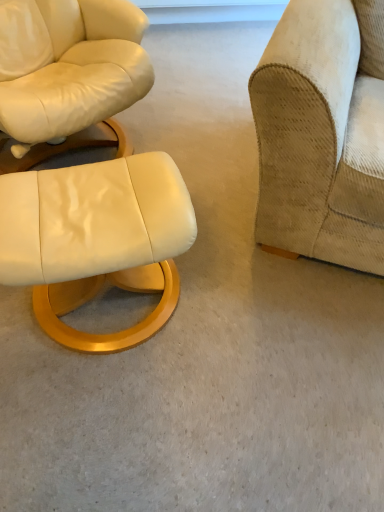
I want to click on beige corduroy couch at right, so click(323, 133).

What do you see at coordinates (323, 133) in the screenshot? The image size is (384, 512). I see `beige corduroy couch at right` at bounding box center [323, 133].

What do you see at coordinates (96, 240) in the screenshot?
I see `matte white leather ottoman at lower left` at bounding box center [96, 240].

The width and height of the screenshot is (384, 512). Identify the location of matte white leather ottoman at lower left. (96, 240).

Locate an element on the screen. The height and width of the screenshot is (512, 384). beige corduroy couch at right is located at coordinates (323, 133).

Which is more to the left, beige corduroy couch at right or matte white leather ottoman at lower left?

Positioned to the left is matte white leather ottoman at lower left.

Who is more distant, beige corduroy couch at right or matte white leather ottoman at lower left?

matte white leather ottoman at lower left is more distant.

Is point (368, 74) closer to viewer compared to point (110, 267)?

That is False.

From the image's perspective, is beige corduroy couch at right over matte white leather ottoman at lower left?

Yes, from the image's perspective, beige corduroy couch at right is on top of matte white leather ottoman at lower left.

From a real-world perspective, who is located lower, beige corduroy couch at right or matte white leather ottoman at lower left?

From a 3D spatial view, matte white leather ottoman at lower left is below.

Looking at their sizes, would you say beige corduroy couch at right is wider or thinner than matte white leather ottoman at lower left?

Clearly, beige corduroy couch at right has more width compared to matte white leather ottoman at lower left.

Which of these two, beige corduroy couch at right or matte white leather ottoman at lower left, stands shorter?

matte white leather ottoman at lower left is shorter.

Considering the relative sizes of beige corduroy couch at right and matte white leather ottoman at lower left in the image provided, is beige corduroy couch at right bigger than matte white leather ottoman at lower left?

Yes, beige corduroy couch at right is bigger than matte white leather ottoman at lower left.

Is matte white leather ottoman at lower left inside beige corduroy couch at right?

Definitely not — matte white leather ottoman at lower left is not inside beige corduroy couch at right.

Would you say beige corduroy couch at right is a long distance from matte white leather ottoman at lower left?

beige corduroy couch at right is near matte white leather ottoman at lower left, not far away.

Is beige corduroy couch at right facing towards matte white leather ottoman at lower left?

No.

How different are the orientations of beige corduroy couch at right and matte white leather ottoman at lower left in degrees?

The angular difference between beige corduroy couch at right and matte white leather ottoman at lower left is 36.4 degrees.

Image resolution: width=384 pixels, height=512 pixels. Find the location of `studio couch above the matte white leather ottoman at lower left (from the image's perspective)`. studio couch above the matte white leather ottoman at lower left (from the image's perspective) is located at coordinates (323, 133).

Considering the positions of objects matte white leather ottoman at lower left and beige corduroy couch at right in the image provided, who is more to the left, matte white leather ottoman at lower left or beige corduroy couch at right?

From the viewer's perspective, matte white leather ottoman at lower left appears more on the left side.

Relative to beige corduroy couch at right, is matte white leather ottoman at lower left in front or behind?

Visually, matte white leather ottoman at lower left is located behind beige corduroy couch at right.

Is point (158, 269) closer to viewer compared to point (378, 255)?

No, it is not.

From the image's perspective, is matte white leather ottoman at lower left on beige corduroy couch at right?

Actually, matte white leather ottoman at lower left appears below beige corduroy couch at right in the image.

From a real-world perspective, which is physically above, matte white leather ottoman at lower left or beige corduroy couch at right?

beige corduroy couch at right is physically above.

Which object is wider, matte white leather ottoman at lower left or beige corduroy couch at right?

beige corduroy couch at right.

In terms of height, does matte white leather ottoman at lower left look taller or shorter compared to beige corduroy couch at right?

Clearly, matte white leather ottoman at lower left is shorter compared to beige corduroy couch at right.

Based on the photo, considering the sizes of objects matte white leather ottoman at lower left and beige corduroy couch at right in the image provided, who is smaller, matte white leather ottoman at lower left or beige corduroy couch at right?

Smaller between the two is matte white leather ottoman at lower left.

Is beige corduroy couch at right located within matte white leather ottoman at lower left?

No, beige corduroy couch at right is not inside matte white leather ottoman at lower left.

Would you consider matte white leather ottoman at lower left to be distant from beige corduroy couch at right?

matte white leather ottoman at lower left is actually quite close to beige corduroy couch at right.

Could you tell me if matte white leather ottoman at lower left is facing beige corduroy couch at right?

No.

This screenshot has width=384, height=512. I want to click on chair below the beige corduroy couch at right (from a real-world perspective), so click(x=96, y=240).

This screenshot has width=384, height=512. I want to click on studio couch that appears above the matte white leather ottoman at lower left (from a real-world perspective), so click(x=323, y=133).

Where is `studio couch above the matte white leather ottoman at lower left (from the image's perspective)`? studio couch above the matte white leather ottoman at lower left (from the image's perspective) is located at coordinates (323, 133).